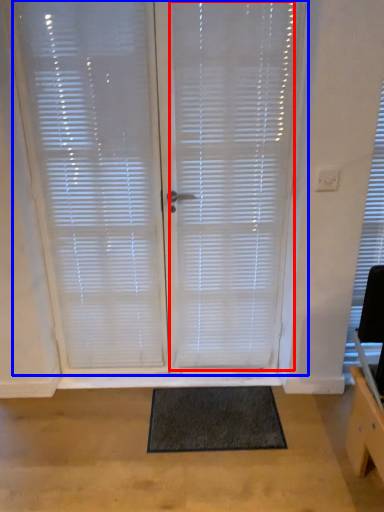
Question: Which of the following is the farthest to the observer, blind (highlighted by a red box) or window blind (highlighted by a blue box)?

Choices:
 (A) blind
 (B) window blind

Answer: (B)